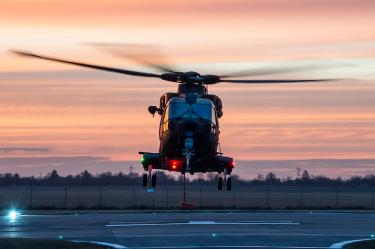
This screenshot has height=249, width=375. Find the location of `green light`. green light is located at coordinates tap(141, 162).